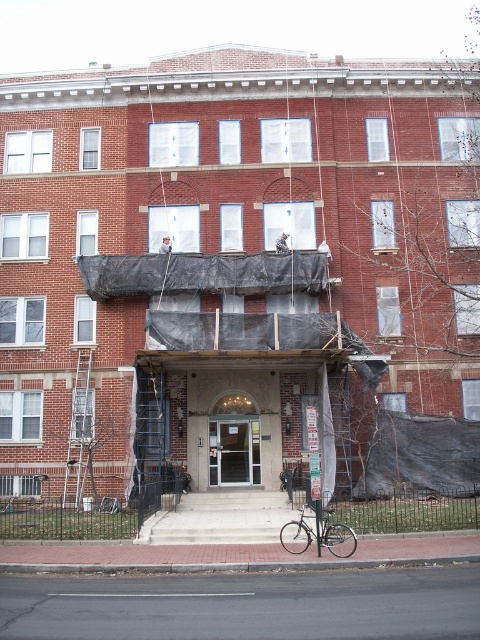
You are a delivery person trying to enter the building through the entrance. You have a package that is 2 meters tall. The entrance has a black tarp at center and a matte glass door at center. Can you fit your package through the entrance without bending it?

The black tarp at center has a greater height compared to matte glass door at center. Since the tarp is taller than the door, the maximum height you can pass through is determined by the matte glass door at center. If the door is shorter than 2 meters, the package wonnt fit. However, the exact height of the door isnnt provided, so we cannt confirm for sure. But since the tarp is taller, if the door allows, the package might fit if the door is at least 2 meters tall.

You are a delivery person trying to enter the building through the entrance. You see the matte glass door at center and the silver metallic bicycle at center. Which object is positioned higher up in the scene?

The matte glass door at center is above the silver metallic bicycle at center, so the matte glass door at center is positioned higher up in the scene.